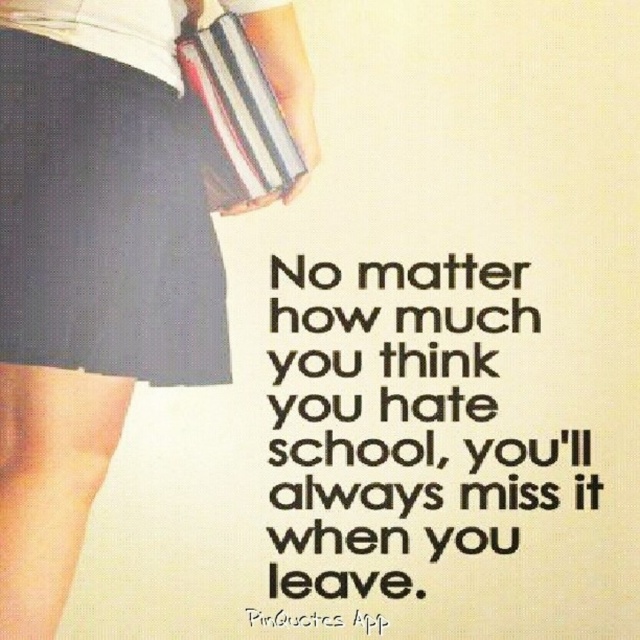
Does matte black skirt at lower left have a smaller size compared to matte black pencil skirt at upper left?

Incorrect, matte black skirt at lower left is not smaller in size than matte black pencil skirt at upper left.

Is matte black skirt at lower left further to the viewer compared to matte black pencil skirt at upper left?

No, it is not.

Which is behind, point (129, 236) or point (228, 173)?

Positioned behind is point (228, 173).

You are a GUI agent. You are given a task and a screenshot of the screen. Output one action in this format:
    pyautogui.click(x=<x>, y=<y>)
    Task: Click on the matte black skirt at lower left
    This screenshot has width=640, height=640.
    Given the screenshot: What is the action you would take?
    pyautogui.click(x=90, y=269)

Between point (458, 420) and point (90, 68), which one is positioned in front?

Positioned in front is point (90, 68).

In the scene shown: Is black paper text at center smaller than dark blue fabric skirt at lower left?

Correct, black paper text at center occupies less space than dark blue fabric skirt at lower left.

Describe the element at coordinates (406, 422) in the screenshot. Image resolution: width=640 pixels, height=640 pixels. I see `black paper text at center` at that location.

Find the location of a particular element. The width and height of the screenshot is (640, 640). black paper text at center is located at coordinates (406, 422).

Between matte black skirt at lower left and black paper text at center, which one is positioned lower?

black paper text at center

Can you confirm if matte black skirt at lower left is positioned above black paper text at center?

Yes.

Locate an element on the screen. The height and width of the screenshot is (640, 640). matte black skirt at lower left is located at coordinates (90, 269).